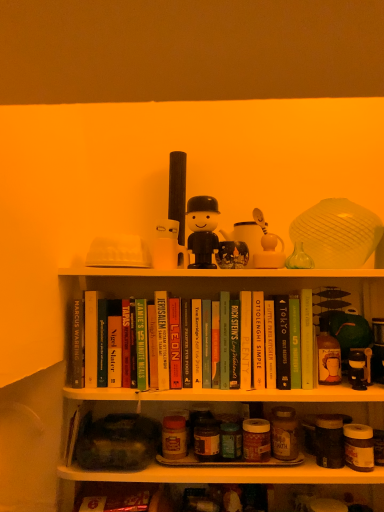
Identify the location of vacant area that is in front of hardcover book at center, the 13th paperback book positioned from the left. (312, 390).